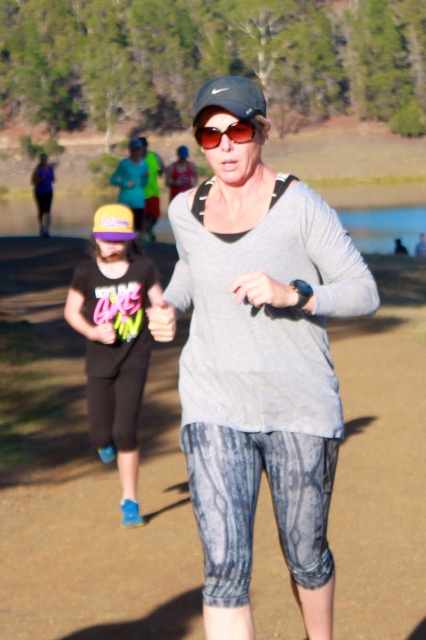
Is black matte shirt at center bigger than matte purple tank top at upper left?

No, black matte shirt at center is not bigger than matte purple tank top at upper left.

Which is more to the right, black matte shirt at center or matte purple tank top at upper left?

Positioned to the right is black matte shirt at center.

Does point (91, 321) come in front of point (48, 170)?

That is True.

Find the location of a particular element. The width and height of the screenshot is (426, 640). black matte shirt at center is located at coordinates (115, 340).

Does point (143, 298) come in front of point (207, 144)?

No, (143, 298) is behind (207, 144).

Which is more to the left, black matte shirt at center or shiny red sunglasses at center?

Positioned to the left is black matte shirt at center.

The height and width of the screenshot is (640, 426). In order to click on black matte shirt at center in this screenshot , I will do `click(115, 340)`.

Can you confirm if gray matte long-sleeve shirt at center is smaller than matte gray shirt at center?

Correct, gray matte long-sleeve shirt at center occupies less space than matte gray shirt at center.

Which of these two, gray matte long-sleeve shirt at center or matte gray shirt at center, stands taller?

Standing taller between the two is matte gray shirt at center.

Between point (236, 504) and point (135, 228), which one is positioned behind?

Point (135, 228)

Identify the location of gray matte long-sleeve shirt at center. The image size is (426, 640). (259, 358).